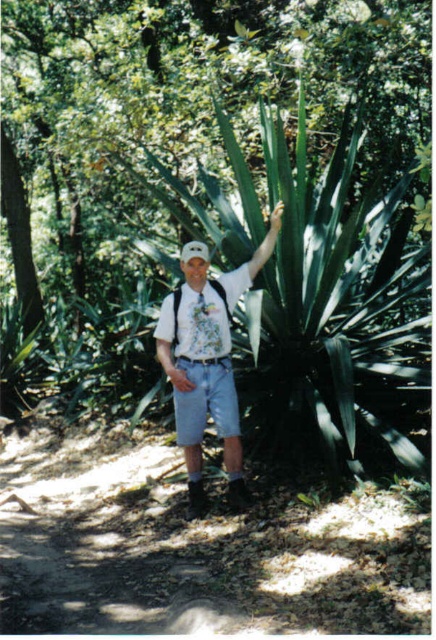
You are standing at the point with coordinates point (x=197, y=320) and want to move towards the point with coordinates point (x=218, y=360). Which direction should you move?

You should move backward because point (x=197, y=320) is in front of point (x=218, y=360).